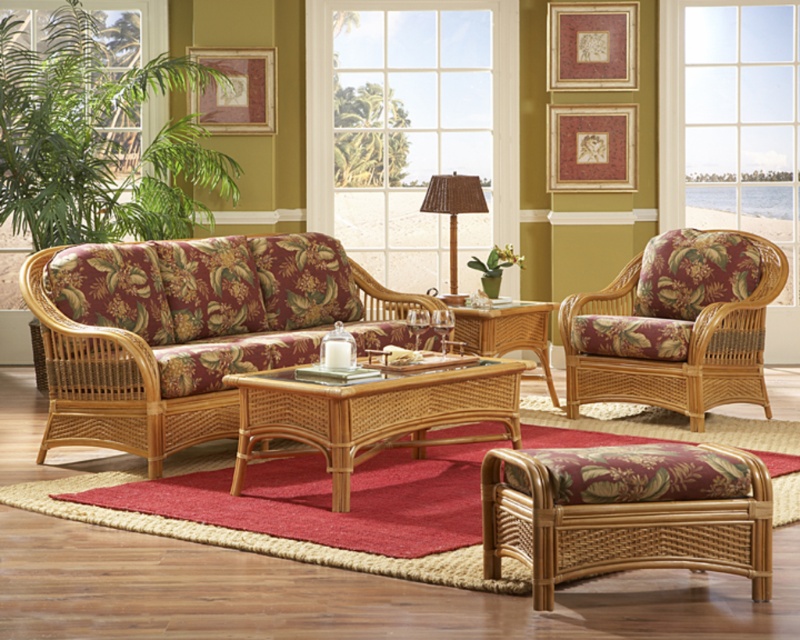
Question: Which of the following is the closest to the observer?

Choices:
 (A) (414, 76)
 (B) (622, 51)
 (C) (268, 116)

Answer: (B)

Question: Does rattan wicker coffee table at center come behind bamboo textured lamp at center?

Choices:
 (A) no
 (B) yes

Answer: (A)

Question: Does gold textured picture frame at upper center come in front of gold textured picture frame at upper left?

Choices:
 (A) no
 (B) yes

Answer: (A)

Question: Is woven rattan armchair at right above green matte pot at center?

Choices:
 (A) no
 (B) yes

Answer: (A)

Question: Which point appears closest to the camera in this image?

Choices:
 (A) (85, 376)
 (B) (504, 253)
 (C) (204, 67)
 (D) (670, 337)

Answer: (A)

Question: Which point is closer to the camera taking this photo?

Choices:
 (A) (570, 54)
 (B) (54, 308)
 (C) (328, 140)

Answer: (B)